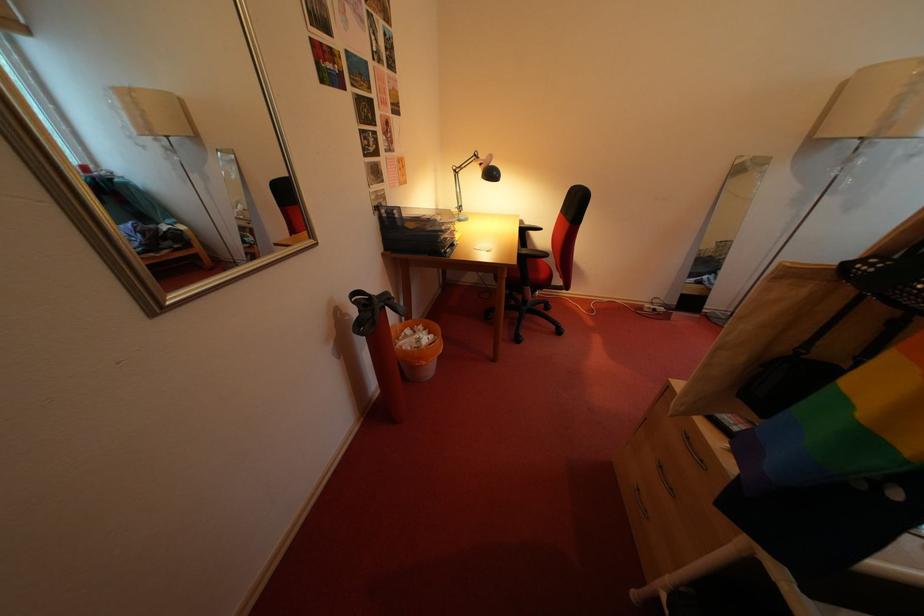
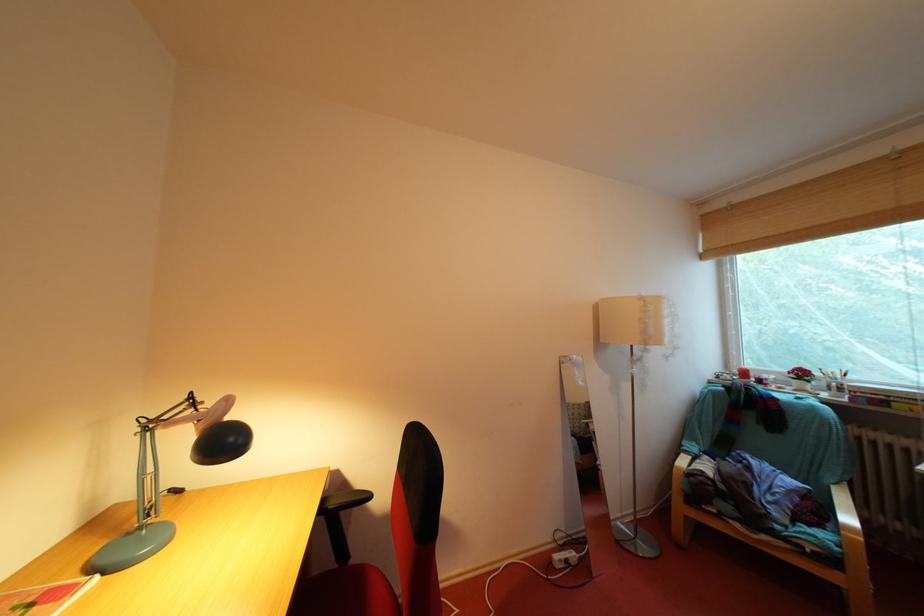
Locate, in the second image, the point that corresponds to pixel 491 177 in the first image.

(204, 446)